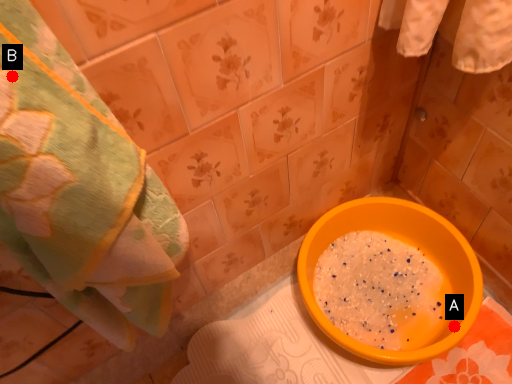
Question: Two points are circled on the image, labeled by A and B beside each circle. Which of the following is the farthest from the observer?

Choices:
 (A) A is further
 (B) B is further

Answer: (A)